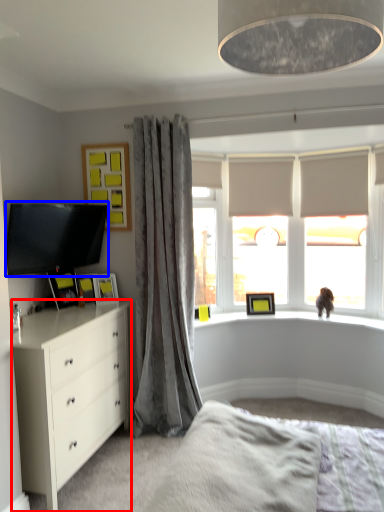
Question: Which object appears closest to the camera in this image, chest of drawers (highlighted by a red box) or television (highlighted by a blue box)?

Choices:
 (A) chest of drawers
 (B) television

Answer: (A)